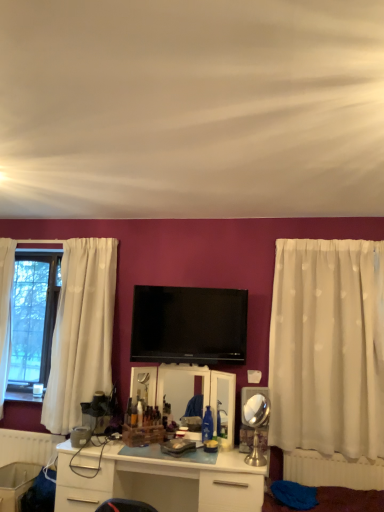
Where is `vacant region above white plastic radiator at lower left, positioned as the 2th radiator in front-to-back order (from a real-world perspective)`? vacant region above white plastic radiator at lower left, positioned as the 2th radiator in front-to-back order (from a real-world perspective) is located at coordinates (39, 432).